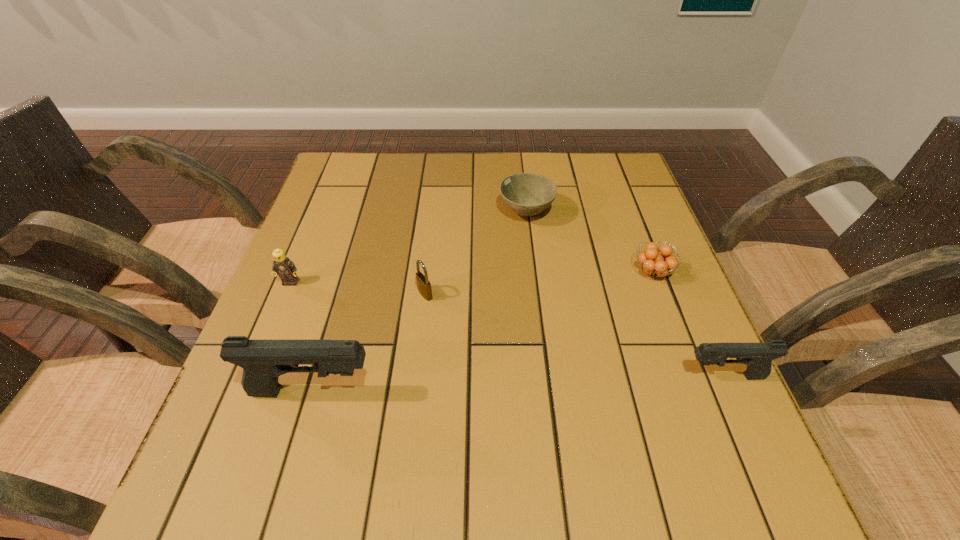
This screenshot has width=960, height=540. I want to click on vacant region between the orange fruit and the left pistol, so click(482, 332).

Identify the location of vacant region between the Lego and the taller pistol. The width and height of the screenshot is (960, 540). (301, 337).

You are a GUI agent. You are given a task and a screenshot of the screen. Output one action in this format:
    pyautogui.click(x=<x>, y=<y>)
    Task: Click on the free space between the right pistol and the orange fruit
    This screenshot has height=540, width=960.
    Given the screenshot: What is the action you would take?
    pyautogui.click(x=688, y=324)

Identify the location of empty space that is in between the bowl and the taller pistol. (420, 302).

Where is `unoccupied position between the tallest object and the orange fruit`? This screenshot has height=540, width=960. unoccupied position between the tallest object and the orange fruit is located at coordinates (482, 332).

This screenshot has height=540, width=960. Identify the location of empty location between the third object from left to right and the third object from right to left. (475, 253).

Where is `empty space that is in between the shorter pistol and the orange fruit`? This screenshot has width=960, height=540. empty space that is in between the shorter pistol and the orange fruit is located at coordinates (688, 324).

The image size is (960, 540). Identify the location of unoccupied area between the orange fruit and the taller pistol. (482, 332).

The image size is (960, 540). In order to click on free space between the padlock and the Lego in this screenshot , I will do `click(358, 288)`.

Where is `free space between the third object from left to right and the shorter pistol`? free space between the third object from left to right and the shorter pistol is located at coordinates (574, 335).